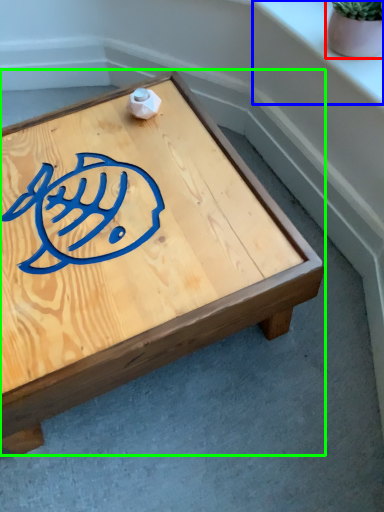
Question: Which object is the closest to the flowerpot (highlighted by a red box)? Choose among these: window sill (highlighted by a blue box) or coffee table (highlighted by a green box).

Choices:
 (A) window sill
 (B) coffee table

Answer: (A)